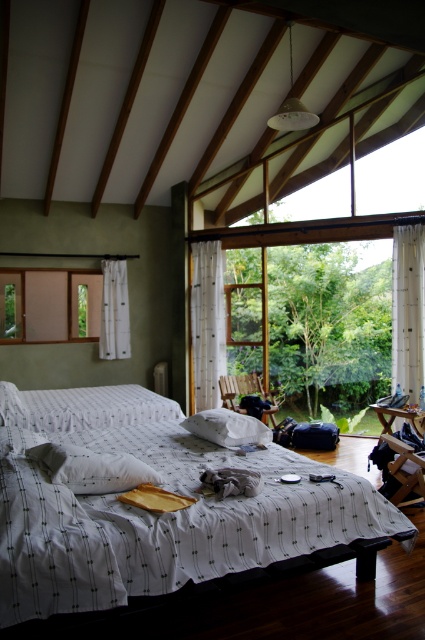
You are a delivery person who needs to place a small package between the white soft pillow at center and the white sheer curtain at left. Can you fit it there?

The distance between the white soft pillow at center and the white sheer curtain at left is 12.27 feet, which is more than enough space to fit a small package between them.